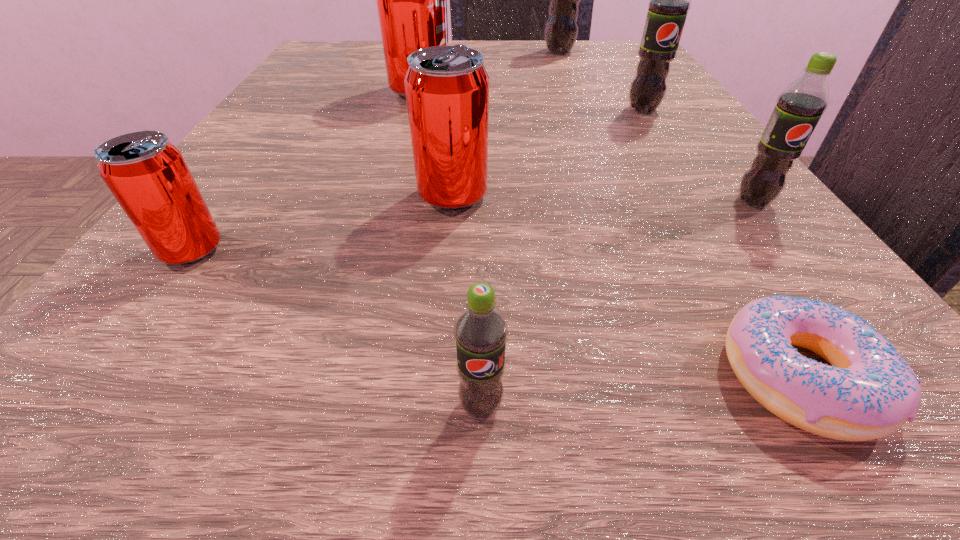
In order to click on vacant area that lies between the third smallest green soda and the smallest green soda in this screenshot , I will do `click(562, 258)`.

The height and width of the screenshot is (540, 960). Find the location of `the fifth closest object to the second farthest green soda`. the fifth closest object to the second farthest green soda is located at coordinates (869, 392).

Where is `object that ranks as the seventh closest to the second biggest green soda`? Image resolution: width=960 pixels, height=540 pixels. object that ranks as the seventh closest to the second biggest green soda is located at coordinates (147, 174).

Locate an element on the screen. soda that is the third closest to the farthest red soda can is located at coordinates (669, 0).

Identify which soda is the fifth nearest to the second biggest red soda can. Please provide its 2D coordinates. Your answer should be formatted as a tuple, i.e. [(x, y)], where the tuple contains the x and y coordinates of a point satisfying the conditions above.

[(799, 107)]

The height and width of the screenshot is (540, 960). In order to click on green soda that is the third nearest to the nearest green soda in this screenshot , I will do `click(561, 30)`.

Where is `the third closest green soda to the nearest green soda`? The width and height of the screenshot is (960, 540). the third closest green soda to the nearest green soda is located at coordinates (561, 30).

Identify which red soda can is the second nearest to the smallest red soda can. Please provide its 2D coordinates. Your answer should be formatted as a tuple, i.e. [(x, y)], where the tuple contains the x and y coordinates of a point satisfying the conditions above.

[(411, 0)]

Locate an element on the screen. red soda can that is the closest one to the third farthest green soda is located at coordinates (447, 87).